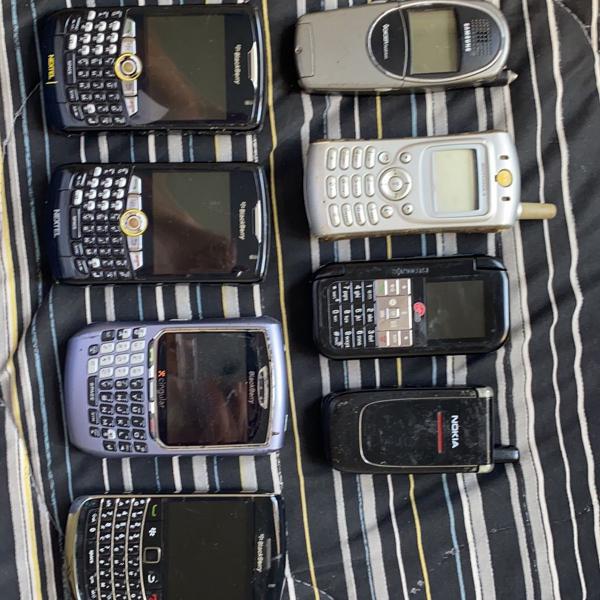
Locate an element on the screen. The image size is (600, 600). phones is located at coordinates (165, 60), (380, 47), (206, 184), (436, 162), (222, 382), (456, 290), (208, 526), (446, 451).